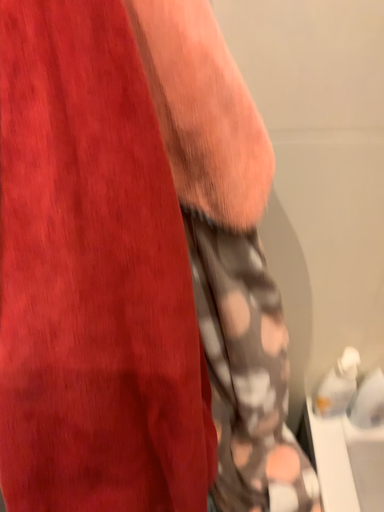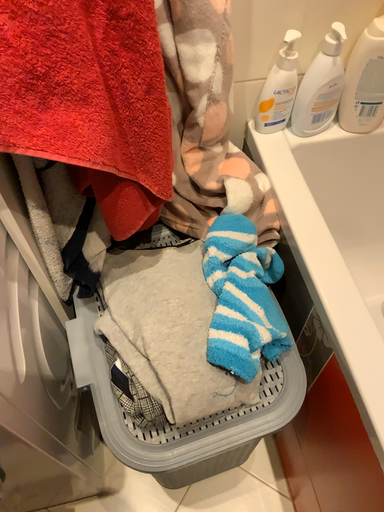
Question: Which way did the camera rotate in the video?

Choices:
 (A) rotated downward
 (B) rotated upward

Answer: (A)